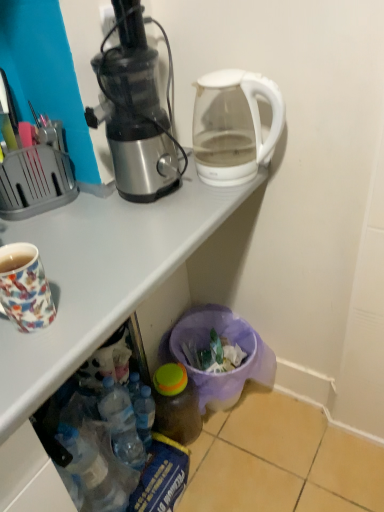
Find the location of a particular element. This screenshot has width=384, height=512. vacant region below metallic silver juicer at left (from a real-world perspective) is located at coordinates (150, 199).